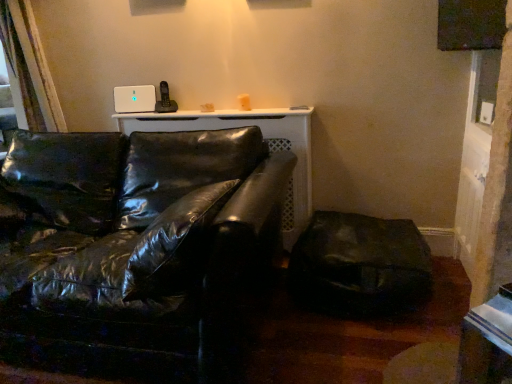
Question: Is the position of matte black window screen at upper right more distant than that of glossy black leather couch at center?

Choices:
 (A) no
 (B) yes

Answer: (B)

Question: Is matte black window screen at upper right at the left side of glossy black leather couch at center?

Choices:
 (A) yes
 (B) no

Answer: (B)

Question: Is matte black window screen at upper right not within glossy black leather couch at center?

Choices:
 (A) yes
 (B) no

Answer: (A)

Question: From the image's perspective, is matte black window screen at upper right located above glossy black leather couch at center?

Choices:
 (A) yes
 (B) no

Answer: (A)

Question: From a real-world perspective, does matte black window screen at upper right stand above glossy black leather couch at center?

Choices:
 (A) no
 (B) yes

Answer: (B)

Question: From the image's perspective, relative to matte black window screen at upper right, is glossy black leather couch at center above or below?

Choices:
 (A) above
 (B) below

Answer: (B)

Question: Is glossy black leather couch at center spatially inside matte black window screen at upper right, or outside of it?

Choices:
 (A) outside
 (B) inside

Answer: (A)

Question: Is glossy black leather couch at center taller or shorter than matte black window screen at upper right?

Choices:
 (A) short
 (B) tall

Answer: (B)

Question: In terms of width, does glossy black leather couch at center look wider or thinner when compared to matte black window screen at upper right?

Choices:
 (A) wide
 (B) thin

Answer: (A)

Question: In terms of width, does matte black swivel chair at lower right look wider or thinner when compared to glossy black leather couch at center?

Choices:
 (A) thin
 (B) wide

Answer: (A)

Question: From a real-world perspective, is matte black swivel chair at lower right physically located above or below glossy black leather couch at center?

Choices:
 (A) above
 (B) below

Answer: (B)

Question: In terms of height, does matte black swivel chair at lower right look taller or shorter compared to glossy black leather couch at center?

Choices:
 (A) short
 (B) tall

Answer: (A)

Question: Visually, is matte black swivel chair at lower right positioned to the left or to the right of glossy black leather couch at center?

Choices:
 (A) right
 (B) left

Answer: (A)

Question: Would you say matte black window screen at upper right is inside or outside glossy black leather couch at center?

Choices:
 (A) outside
 (B) inside

Answer: (A)

Question: From the image's perspective, is matte black window screen at upper right above or below glossy black leather couch at center?

Choices:
 (A) below
 (B) above

Answer: (B)